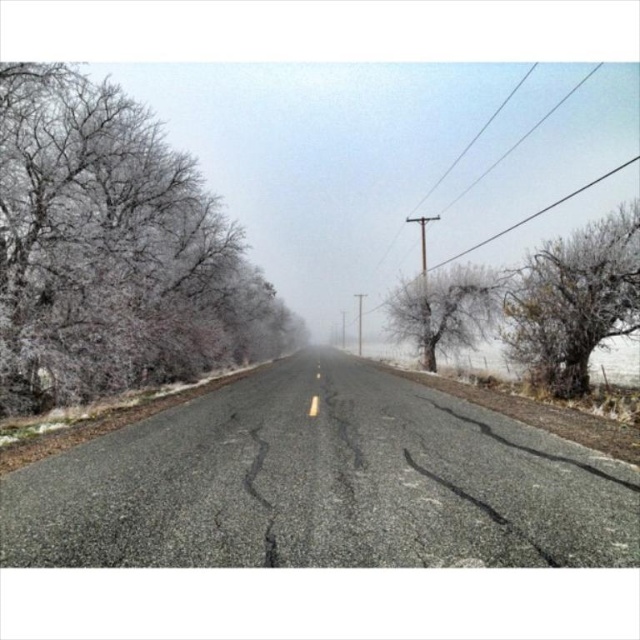
Question: Does frosted branches at left come behind frosted bark tree at right?

Choices:
 (A) no
 (B) yes

Answer: (A)

Question: Is frosted bark tree at right wider than frosted ice tree at center?

Choices:
 (A) yes
 (B) no

Answer: (B)

Question: Estimate the real-world distances between objects in this image. Which object is closer to the frosted ice tree at center?

Choices:
 (A) frosted branches at left
 (B) frosted bark tree at right

Answer: (B)

Question: Which of the following is the farthest from the observer?

Choices:
 (A) (465, 275)
 (B) (570, 336)
 (C) (51, 209)

Answer: (A)

Question: Among these objects, which one is farthest from the camera?

Choices:
 (A) frosted bark tree at right
 (B) frosted ice tree at center

Answer: (B)

Question: Does frosted branches at left lie behind frosted ice tree at center?

Choices:
 (A) no
 (B) yes

Answer: (A)